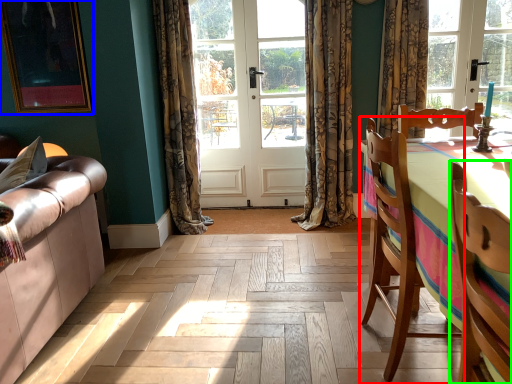
Question: Estimate the real-world distances between objects in this image. Which object is closer to chair (highlighted by a red box), picture frame (highlighted by a blue box) or chair (highlighted by a green box)?

Choices:
 (A) picture frame
 (B) chair

Answer: (B)